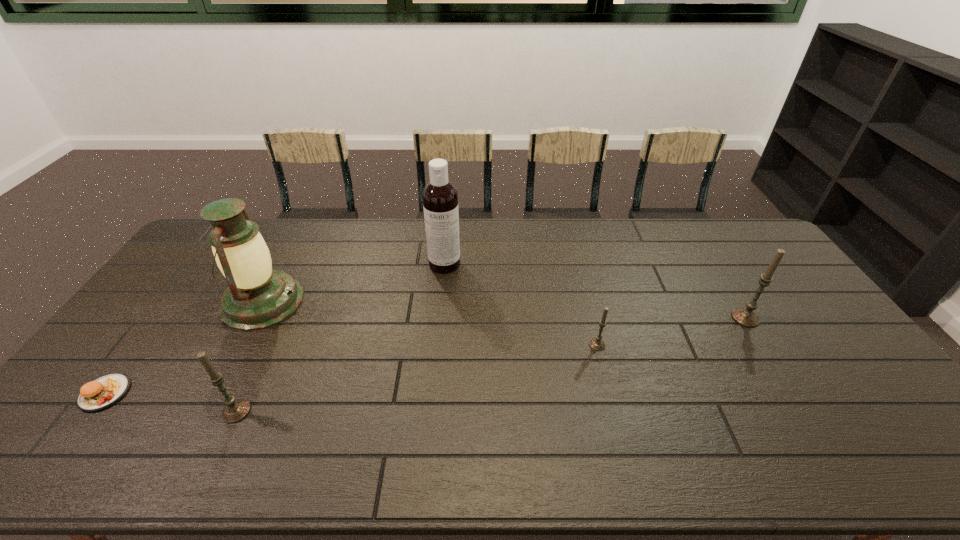
To make them evenly spaced by inserting another candle among them, please locate a free space for this new candle. Please provide its 2D coordinates. Your answer should be formatted as a tuple, i.e. [(x, y)], where the tuple contains the x and y coordinates of a point satisfying the conditions above.

[(429, 376)]